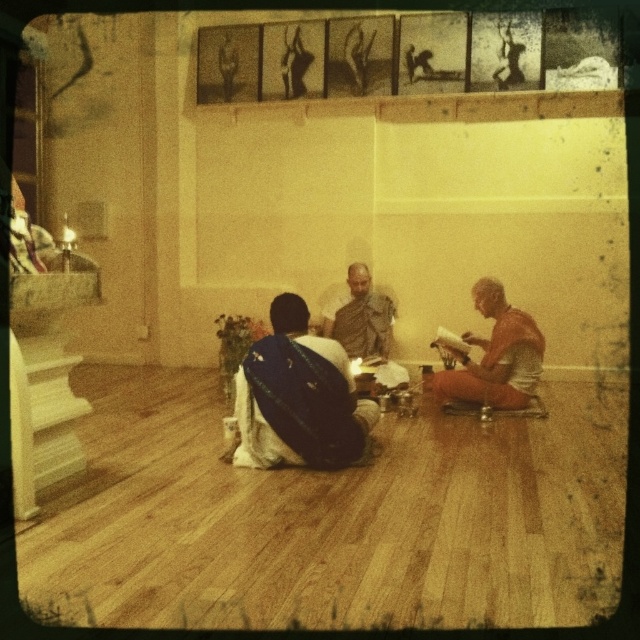
Is point (300, 321) less distant than point (346, 305)?

Yes.

Consider the image. Is blue silk saree at center below matte brown robe at center?

Indeed, blue silk saree at center is positioned under matte brown robe at center.

Identify the location of blue silk saree at center. The image size is (640, 640). (298, 397).

Does point (332, 378) come closer to viewer compared to point (488, 371)?

Yes, it is in front of point (488, 371).

Which is behind, point (328, 369) or point (508, 314)?

Positioned behind is point (508, 314).

This screenshot has width=640, height=640. Find the location of `blue silk saree at center`. blue silk saree at center is located at coordinates (298, 397).

In the scene shown: Is orange cotton cloth at right smaller than matte brown robe at center?

Incorrect, orange cotton cloth at right is not smaller in size than matte brown robe at center.

Is point (499, 394) positioned after point (353, 349)?

No, it is not.

The image size is (640, 640). I want to click on orange cotton cloth at right, so pos(493,356).